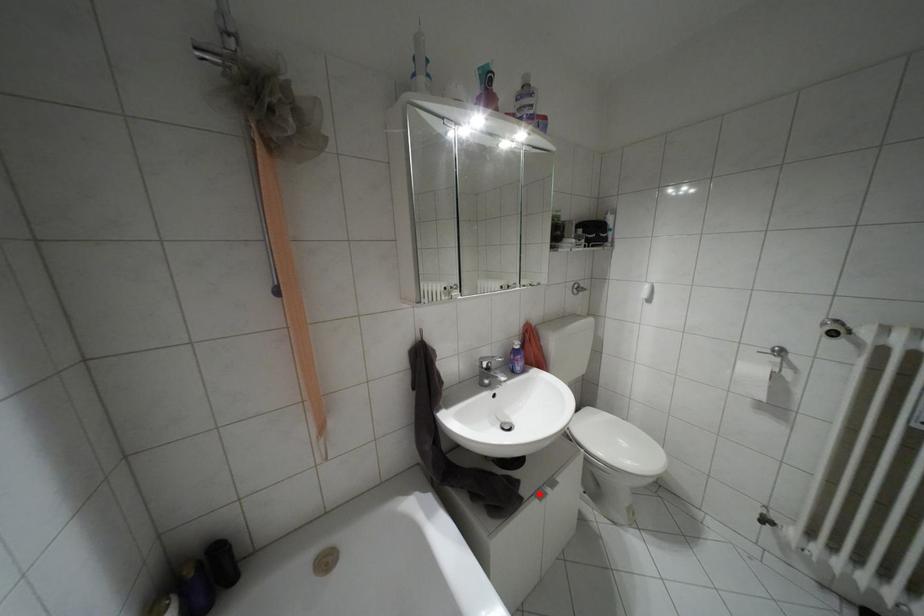
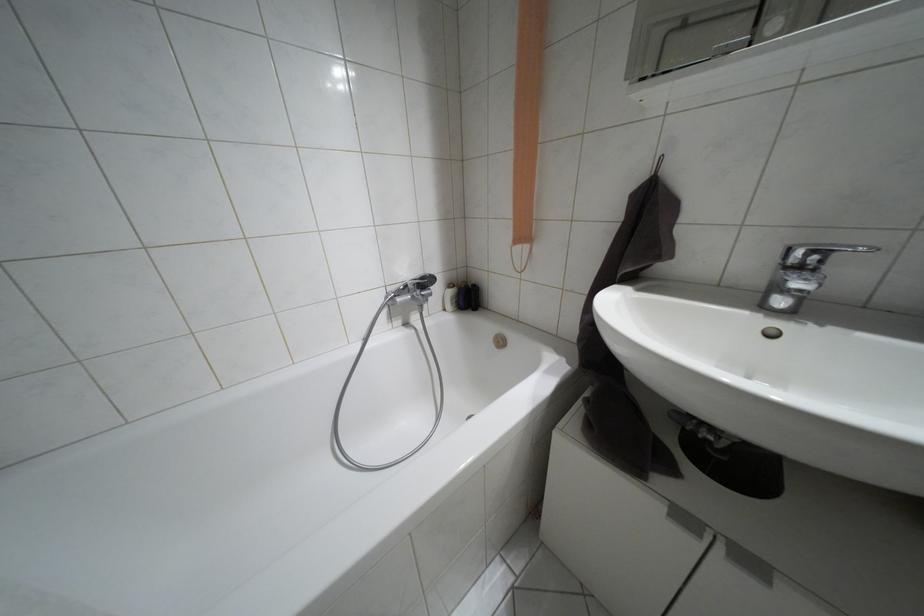
Find the pixel in the second image that matches the highlighted location in the first image.

(684, 517)